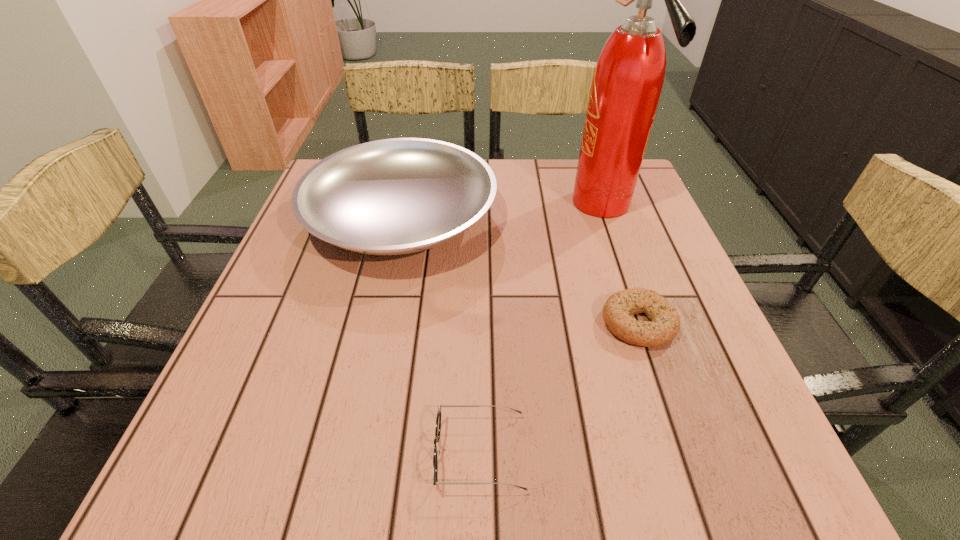
The height and width of the screenshot is (540, 960). I want to click on free space that is in between the bagel and the second tallest object, so click(x=519, y=270).

Identify the location of vacant region between the spectacles and the bedpan. Image resolution: width=960 pixels, height=540 pixels. (441, 335).

Where is `free space that is in between the second nearest object and the tallest object`? The height and width of the screenshot is (540, 960). free space that is in between the second nearest object and the tallest object is located at coordinates (620, 264).

Select which object appears as the second closest to the spectacles. Please provide its 2D coordinates. Your answer should be formatted as a tuple, i.e. [(x, y)], where the tuple contains the x and y coordinates of a point satisfying the conditions above.

[(395, 196)]

At what (x,y) coordinates should I click in order to perform the action: click on object that is the second closest to the third farthest object. Please return your answer as a coordinate pair (x, y). The width and height of the screenshot is (960, 540). Looking at the image, I should click on (438, 420).

The width and height of the screenshot is (960, 540). Identify the location of free location that satisfies the following two spatial constraints: 1. on the front side of the second nearest object; 2. through the lenses of the spectacles. (682, 453).

The width and height of the screenshot is (960, 540). Find the location of `vacant area that satisfies the following two spatial constraints: 1. on the front side of the tallest object; 2. through the lenses of the spectacles`. vacant area that satisfies the following two spatial constraints: 1. on the front side of the tallest object; 2. through the lenses of the spectacles is located at coordinates (687, 453).

In order to click on vacant point that satisfies the following two spatial constraints: 1. on the front side of the bagel; 2. through the lenses of the spectacles in this screenshot , I will do `click(682, 453)`.